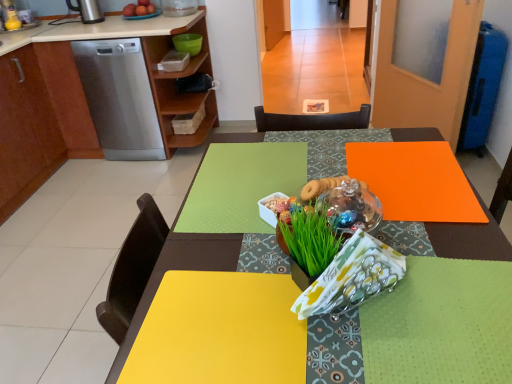
Question: Should I look upward or downward to see green leafy grass at center?

Choices:
 (A) up
 (B) down

Answer: (B)

Question: Does green matte tablecloth at center have a lesser width compared to matte wood cabinet at left, the 1th cabinetry in the right-to-left sequence?

Choices:
 (A) no
 (B) yes

Answer: (B)

Question: Is green matte tablecloth at center to the right of matte wood cabinet at left, which is counted as the second cabinetry, starting from the left, from the viewer's perspective?

Choices:
 (A) yes
 (B) no

Answer: (A)

Question: Is green matte tablecloth at center positioned in front of matte wood cabinet at left, which is counted as the second cabinetry, starting from the left?

Choices:
 (A) no
 (B) yes

Answer: (B)

Question: Is green matte tablecloth at center positioned with its back to matte wood cabinet at left, the 1th cabinetry in the right-to-left sequence?

Choices:
 (A) no
 (B) yes

Answer: (A)

Question: Are green matte tablecloth at center and matte wood cabinet at left, the 1th cabinetry in the right-to-left sequence, far apart?

Choices:
 (A) yes
 (B) no

Answer: (A)

Question: Could matte wood cabinet at left, the 1th cabinetry in the right-to-left sequence, be considered to be inside green matte tablecloth at center?

Choices:
 (A) yes
 (B) no

Answer: (B)

Question: Does matte wood cabinet at left, the 1th cabinetry in the right-to-left sequence, have a lesser height compared to matte wood cabinet at left, the first cabinetry in the left-to-right sequence?

Choices:
 (A) yes
 (B) no

Answer: (B)

Question: Is the position of matte wood cabinet at left, the 1th cabinetry in the right-to-left sequence, less distant than that of matte wood cabinet at left, the 2th cabinetry viewed from the right?

Choices:
 (A) yes
 (B) no

Answer: (A)

Question: Can you confirm if matte wood cabinet at left, the 1th cabinetry in the right-to-left sequence, is taller than matte wood cabinet at left, the first cabinetry in the left-to-right sequence?

Choices:
 (A) yes
 (B) no

Answer: (A)

Question: Is matte wood cabinet at left, the 1th cabinetry in the right-to-left sequence, positioned far away from matte wood cabinet at left, the first cabinetry in the left-to-right sequence?

Choices:
 (A) yes
 (B) no

Answer: (B)

Question: Is matte wood cabinet at left, the 1th cabinetry in the right-to-left sequence, turned away from matte wood cabinet at left, the first cabinetry in the left-to-right sequence?

Choices:
 (A) yes
 (B) no

Answer: (A)

Question: Is matte wood cabinet at left, the 2th cabinetry viewed from the right, inside matte wood cabinet at left, the 1th cabinetry in the right-to-left sequence?

Choices:
 (A) no
 (B) yes

Answer: (B)

Question: Is satin silver dishwasher at left shorter than green leafy grass at center?

Choices:
 (A) no
 (B) yes

Answer: (A)